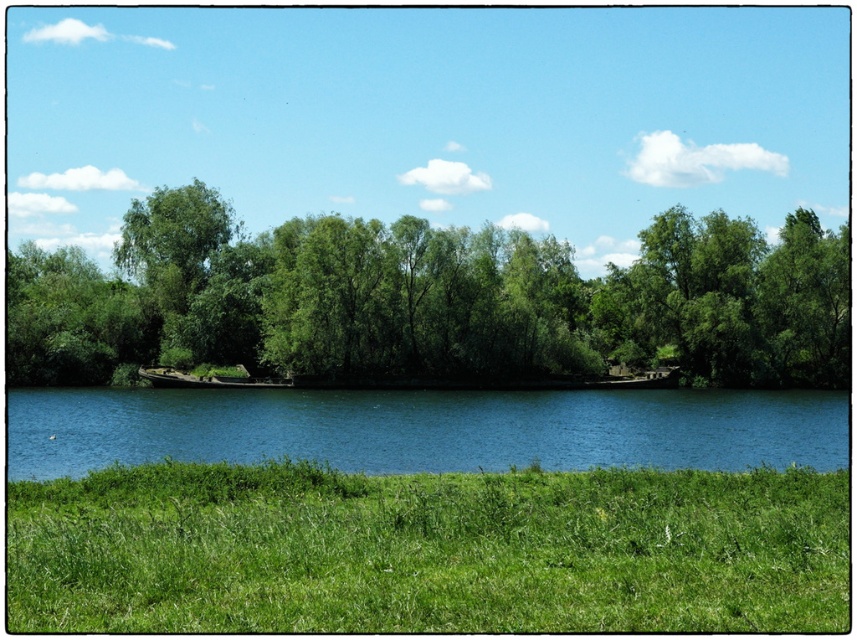
Does point (277, 316) lie behind point (12, 442)?

Yes, it is.

Based on the photo, who is shorter, green leafy trees at center or blue water at center?

blue water at center is shorter.

Find the location of a particular element. green leafy trees at center is located at coordinates (430, 300).

Is point (87, 492) closer to viewer compared to point (783, 317)?

Yes, it is in front of point (783, 317).

At what (x,y) coordinates should I click in order to perform the action: click on green grassy field at lower center. Please return your answer as a coordinate pair (x, y). The height and width of the screenshot is (640, 857). Looking at the image, I should click on [427, 550].

Between green grassy field at lower center and blue water at center, which one appears on the left side from the viewer's perspective?

green grassy field at lower center is more to the left.

Which of these two, green grassy field at lower center or blue water at center, stands shorter?

With less height is blue water at center.

Is point (505, 545) closer to viewer compared to point (172, 397)?

Yes, point (505, 545) is closer to viewer.

The height and width of the screenshot is (640, 857). What are the coordinates of `green grassy field at lower center` in the screenshot? It's located at (427, 550).